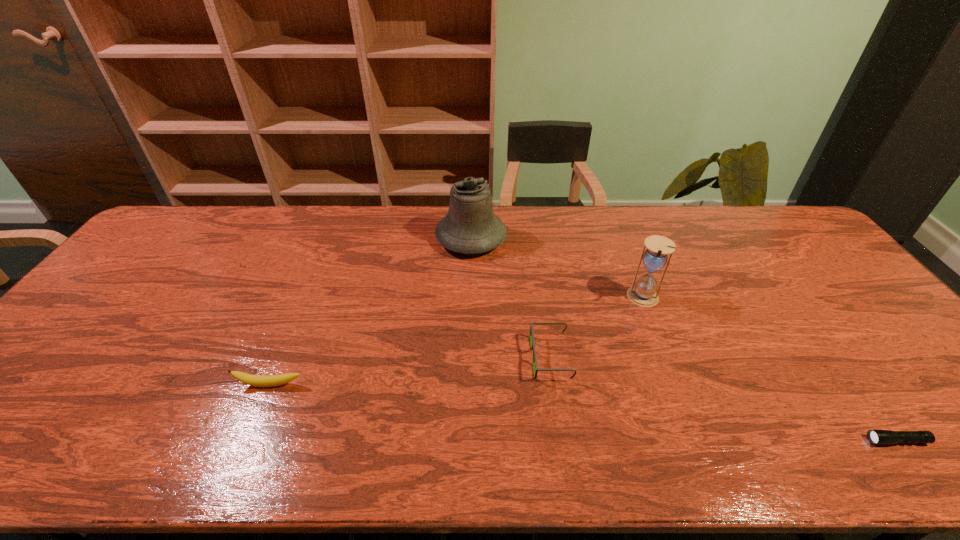
Identify the location of vacant region located on the upward curve of the leftmost object. (247, 441).

The height and width of the screenshot is (540, 960). In order to click on blank space located on the lens of the third object from right to left in this screenshot , I will do `click(456, 357)`.

I want to click on free spot located on the lens of the third object from right to left, so click(x=488, y=357).

Locate an element on the screen. This screenshot has width=960, height=540. free region located 0.400m on the lens of the third object from right to left is located at coordinates (372, 357).

Locate an element on the screen. vacant space located at the lens end of the flashlight is located at coordinates pos(836,441).

Find the location of `vacant area situated at the lens end of the flashlight`. vacant area situated at the lens end of the flashlight is located at coordinates (780, 441).

Where is `vacant space located 0.280m at the lens end of the flashlight`? vacant space located 0.280m at the lens end of the flashlight is located at coordinates (738, 441).

The width and height of the screenshot is (960, 540). I want to click on object at the far edge, so click(x=470, y=227).

I want to click on object situated at the near edge, so click(x=877, y=437).

You are a GUI agent. You are given a task and a screenshot of the screen. Output one action in this format:
    pyautogui.click(x=<x>, y=<y>)
    Task: Click on the object present at the right edge
    
    Given the screenshot: What is the action you would take?
    pyautogui.click(x=877, y=437)